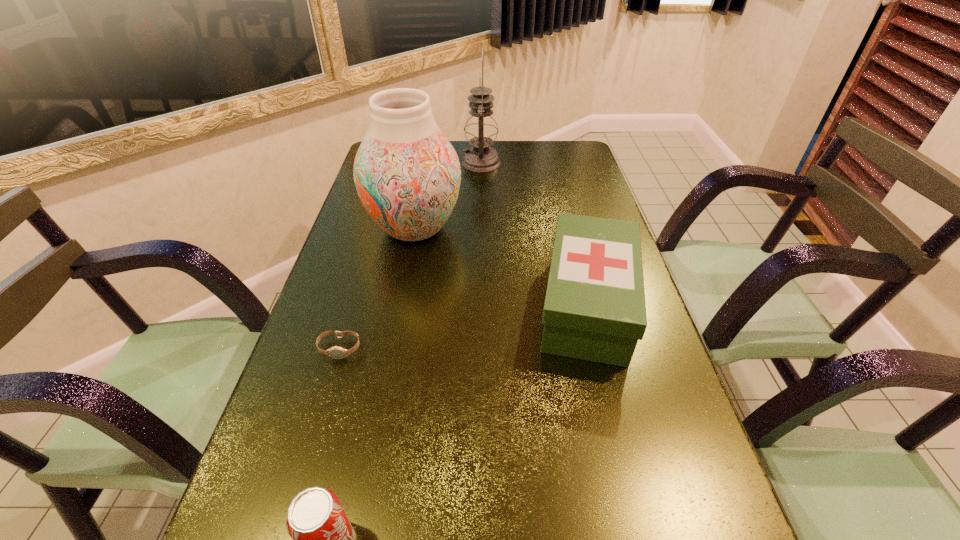
This screenshot has height=540, width=960. Identify the location of the farthest object. (481, 129).

At what (x,y) coordinates should I click in order to perform the action: click on vase. Please return your answer as a coordinate pair (x, y). The height and width of the screenshot is (540, 960). Looking at the image, I should click on (407, 174).

At what (x,y) coordinates should I click in order to perform the action: click on the first-aid kit. Please return your answer as a coordinate pair (x, y). The image size is (960, 540). Looking at the image, I should click on (594, 309).

The height and width of the screenshot is (540, 960). I want to click on watch, so click(x=335, y=352).

This screenshot has height=540, width=960. Find the location of `free region located on the right of the oil lamp`. free region located on the right of the oil lamp is located at coordinates (586, 163).

Where is `vacant space positioned 0.330m on the front of the vase`? The image size is (960, 540). vacant space positioned 0.330m on the front of the vase is located at coordinates (389, 366).

This screenshot has height=540, width=960. What are the coordinates of `vacant region located 0.370m on the left of the first-aid kit` in the screenshot? It's located at (369, 305).

Where is `vacant space located 0.230m on the face of the shortest object`? vacant space located 0.230m on the face of the shortest object is located at coordinates (301, 474).

Find the location of `object present at the far edge`. object present at the far edge is located at coordinates (481, 129).

Where is `vase at the left edge`? The width and height of the screenshot is (960, 540). vase at the left edge is located at coordinates (407, 174).